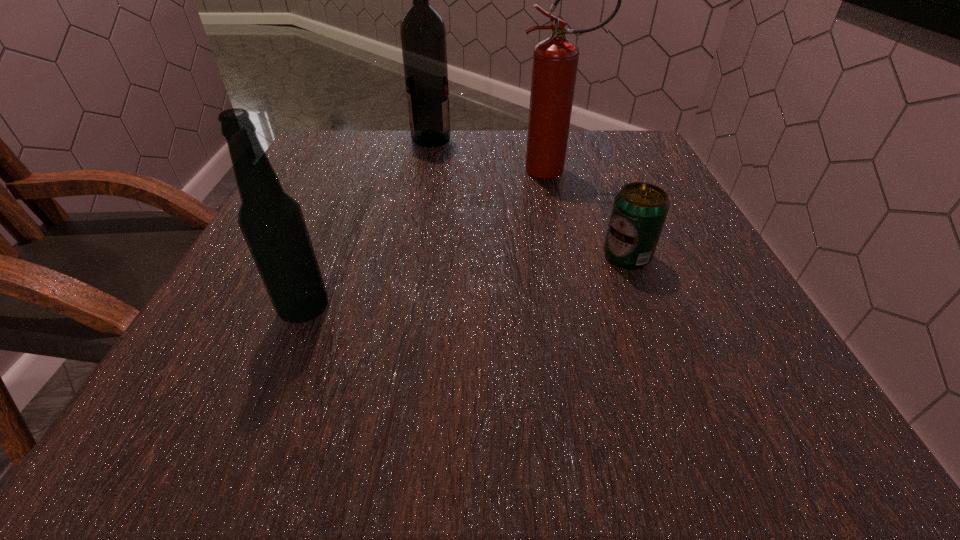
This screenshot has height=540, width=960. I want to click on free space located from the nozzle of the third nearest object, so click(x=392, y=171).

This screenshot has width=960, height=540. In order to click on free spot located on the back of the left alcohol in this screenshot , I will do `click(336, 232)`.

The image size is (960, 540). What are the coordinates of `free space located 0.140m on the back of the beer can` in the screenshot? It's located at (605, 200).

The image size is (960, 540). I want to click on alcohol that is positioned at the far edge, so (x=423, y=35).

What are the coordinates of `fire extinguisher present at the far edge` in the screenshot? It's located at (555, 60).

Where is `object at the left edge`? The image size is (960, 540). object at the left edge is located at coordinates (272, 223).

Where is `fire extinguisher located in the right edge section of the desktop`? Image resolution: width=960 pixels, height=540 pixels. fire extinguisher located in the right edge section of the desktop is located at coordinates pyautogui.click(x=555, y=60).

The width and height of the screenshot is (960, 540). Find the location of `beer can at the right edge`. beer can at the right edge is located at coordinates (639, 211).

Locate an element on the screen. This screenshot has height=540, width=960. object that is at the far right corner is located at coordinates (555, 60).

Locate an element on the screen. The image size is (960, 540). blank space at the far edge is located at coordinates [x=427, y=151].